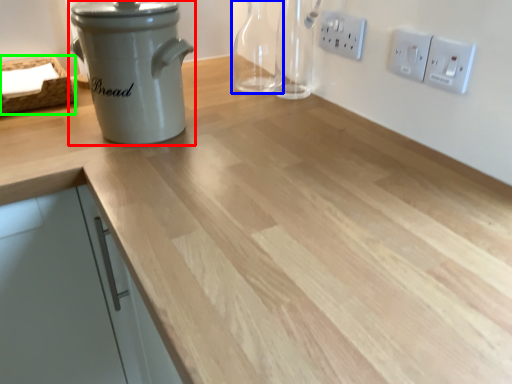
Question: Considering the real-world distances, which object is farthest from kitchen appliance (highlighted by a red box)? bottle (highlighted by a blue box) or basket (highlighted by a green box)?

Choices:
 (A) bottle
 (B) basket

Answer: (A)